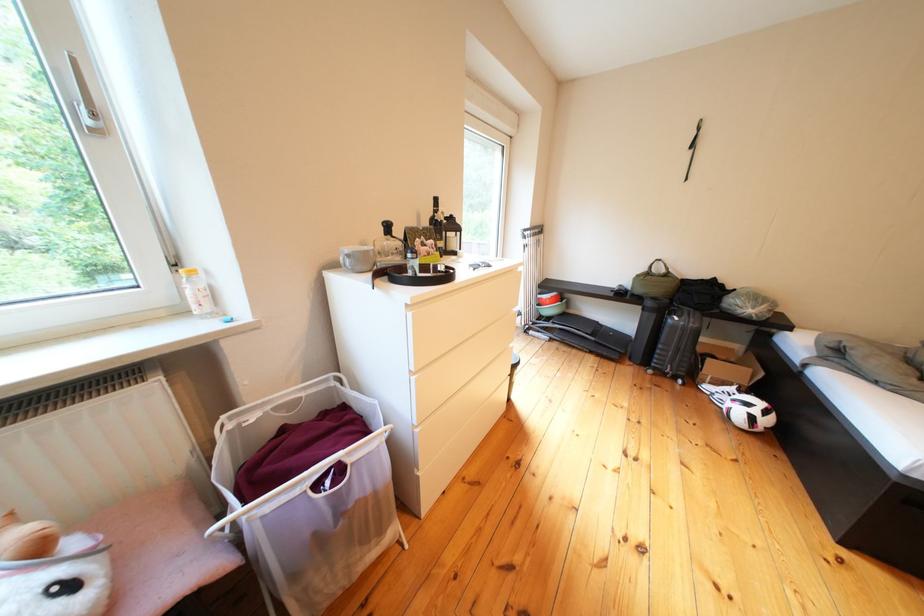
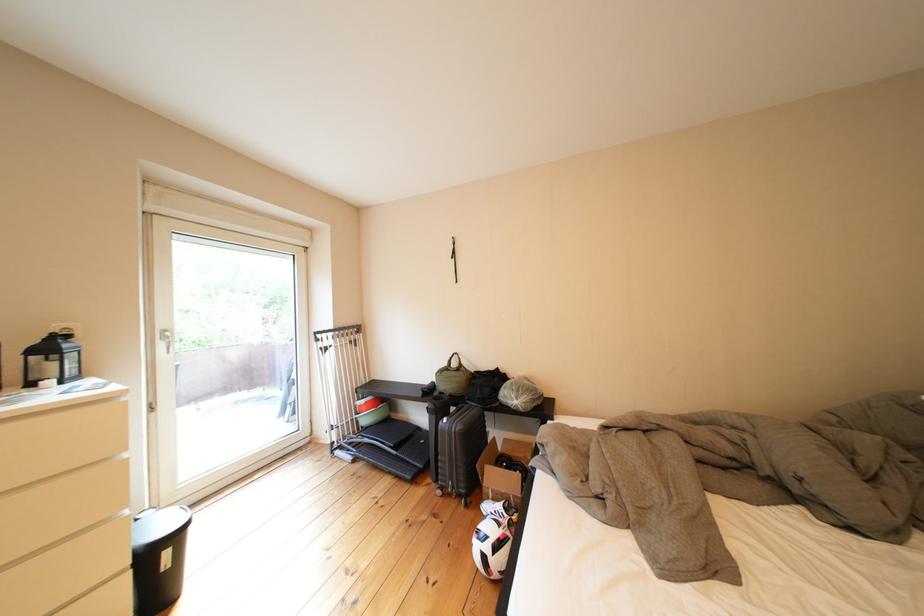
Question: What movement of the cameraman would produce the second image?

Choices:
 (A) Left
 (B) Right
 (C) Forward
 (D) Backward

Answer: (B)